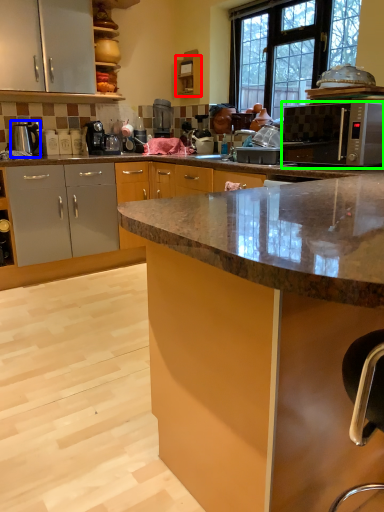
Question: Which object is the farthest from cabinetry (highlighted by a red box)? Choose among these: appliance (highlighted by a blue box) or microwave oven (highlighted by a green box).

Choices:
 (A) appliance
 (B) microwave oven

Answer: (A)